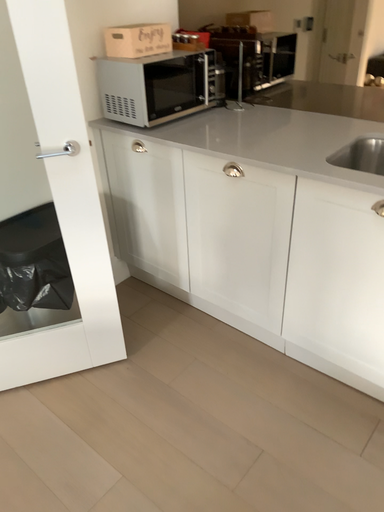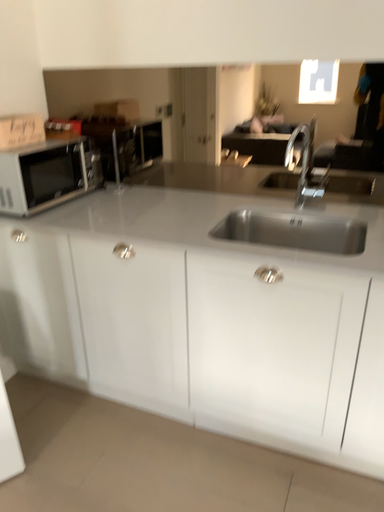
Question: Which way did the camera rotate in the video?

Choices:
 (A) rotated upward
 (B) rotated downward

Answer: (A)